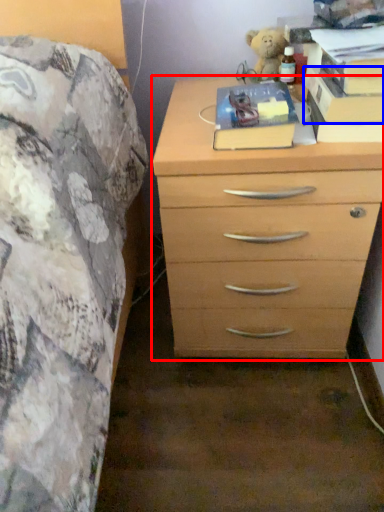
Question: Which object appears farthest to the camera in this image, chest of drawers (highlighted by a red box) or paperback book (highlighted by a blue box)?

Choices:
 (A) chest of drawers
 (B) paperback book

Answer: (B)